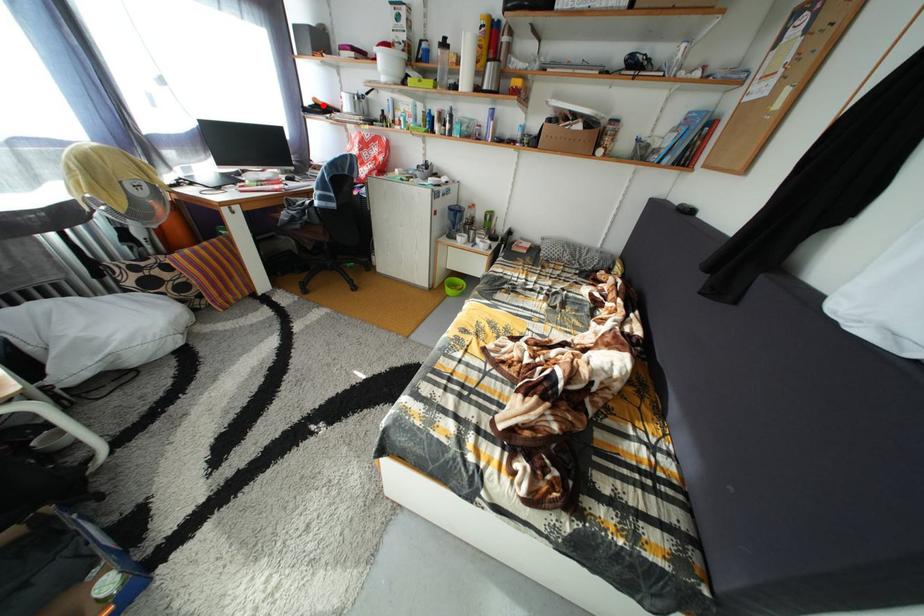
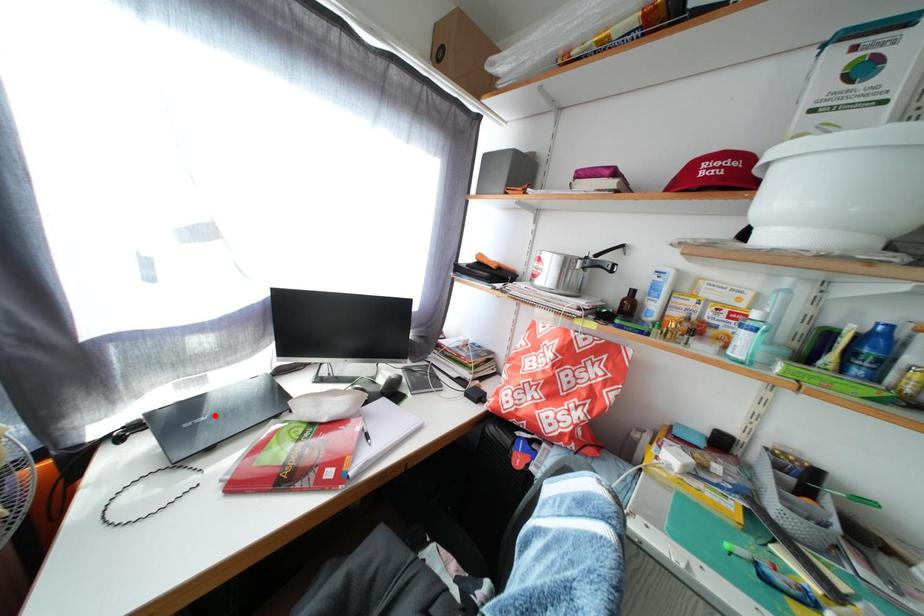
I am providing you with two images of the same scene from different viewpoints. A red point is marked on the first image and another point is marked on the second image. Does the point marked in image1 correspond to the same location as the one in image2?

No